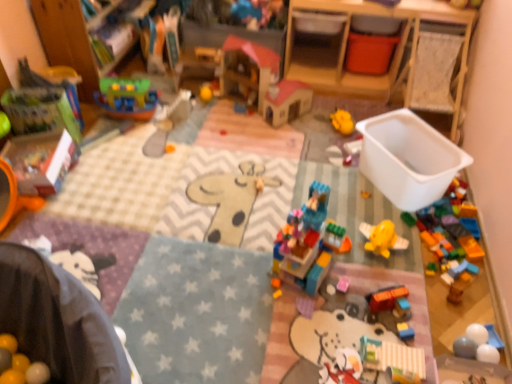
This screenshot has height=384, width=512. Identify the location of empty space that is in between translucent plastic boat at upper left, the 4th toy viewed from the top, and translucent plastic castle at center, the 8th toy from the top. (197, 178).